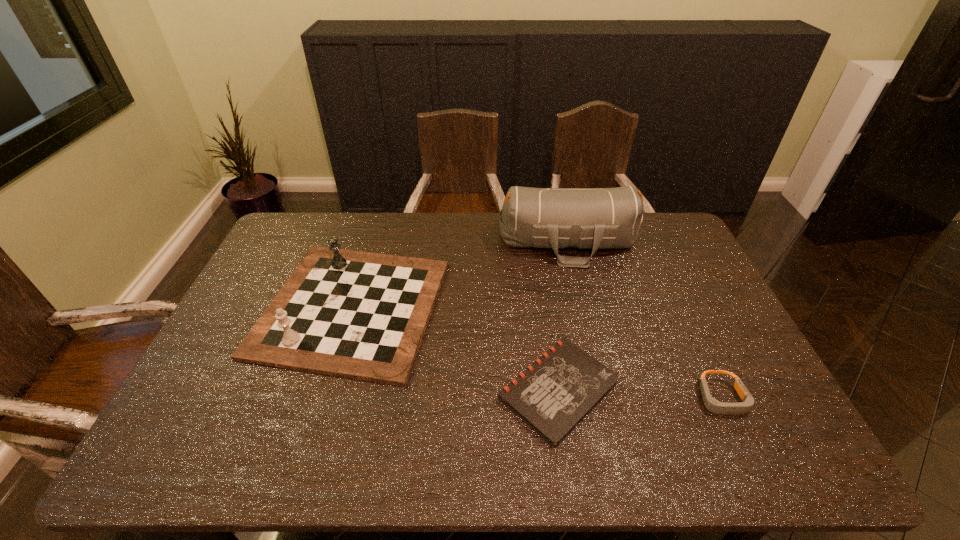
Where is `gameboard present at the far edge`? gameboard present at the far edge is located at coordinates (360, 315).

At what (x,y) coordinates should I click in order to perform the action: click on object that is positioned at the near edge. Please return your answer as a coordinate pair (x, y). Looking at the image, I should click on (553, 395).

I want to click on object situated at the left edge, so click(360, 315).

Identify the location of object that is positioned at the right edge. (711, 404).

Where is `object situated at the far left corner`? object situated at the far left corner is located at coordinates (360, 315).

I want to click on free space at the far edge of the desktop, so click(390, 237).

The width and height of the screenshot is (960, 540). Identify the location of vacant space at the near edge. (730, 463).

This screenshot has height=540, width=960. I want to click on free spot at the right edge of the desktop, so point(678,273).

This screenshot has width=960, height=540. In order to click on blank region between the leftmost object and the shortest object in this screenshot , I will do 455,348.

Identify the location of free space that is in between the notebook and the tallest object. This screenshot has height=540, width=960. (564, 316).